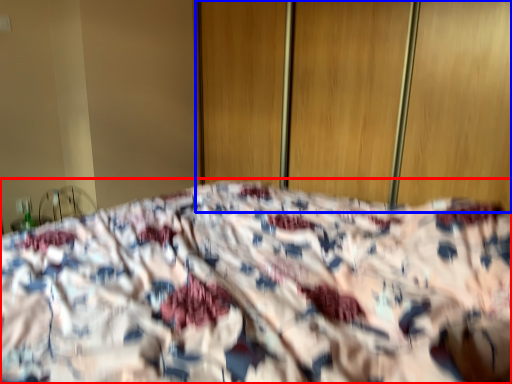
Question: Which object is further to the camera taking this photo, bed (highlighted by a red box) or screen door (highlighted by a blue box)?

Choices:
 (A) bed
 (B) screen door

Answer: (B)